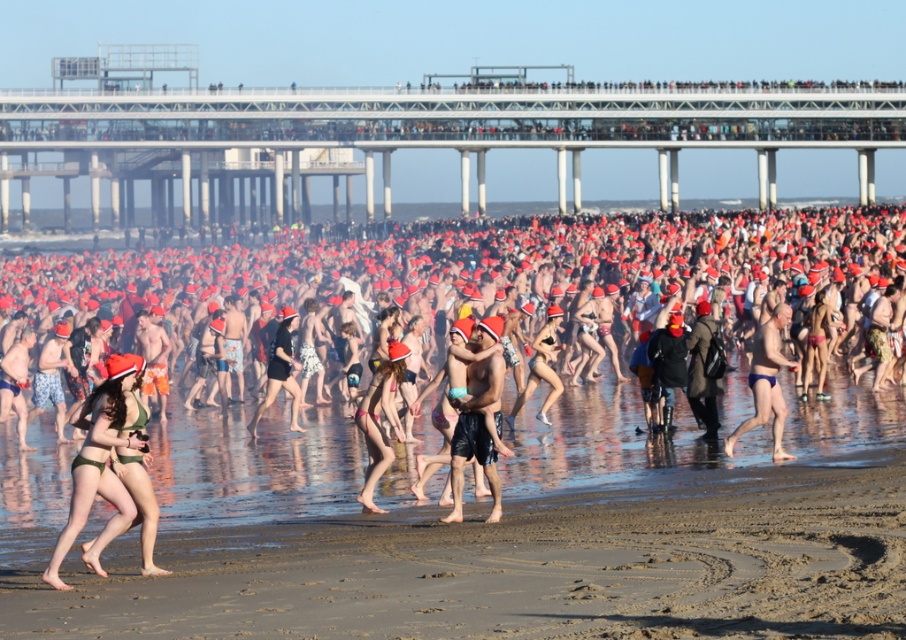
How far apart are blue matte swim trunks at center and pink matte bikini bottom at center?

A distance of 5.99 meters exists between blue matte swim trunks at center and pink matte bikini bottom at center.

Which of these two, blue matte swim trunks at center or pink matte bikini bottom at center, stands shorter?

pink matte bikini bottom at center is shorter.

Image resolution: width=906 pixels, height=640 pixels. I want to click on blue matte swim trunks at center, so click(x=766, y=381).

Who is lower down, green bikini at center or blue matte swim trunks at center?

Positioned lower is green bikini at center.

Does green bikini at center have a lesser width compared to blue matte swim trunks at center?

In fact, green bikini at center might be wider than blue matte swim trunks at center.

Who is more distant from viewer, (95, 422) or (757, 360)?

The point (757, 360) is more distant.

Where is `green bikini at center`? green bikini at center is located at coordinates [100, 465].

Can you confirm if green bikini at lower left is thinner than pink matte bikini bottom at center?

No, green bikini at lower left is not thinner than pink matte bikini bottom at center.

The width and height of the screenshot is (906, 640). What are the coordinates of `green bikini at lower left` in the screenshot? It's located at (509, 253).